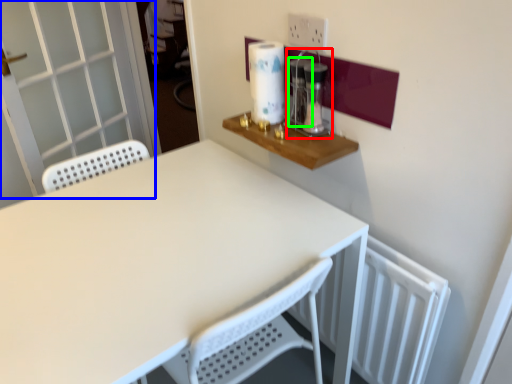
Question: Which object is positioned farthest from coffee machine (highlighted by a red box)? Select from screen door (highlighted by a blue box) and appliance (highlighted by a green box).

Choices:
 (A) screen door
 (B) appliance

Answer: (A)